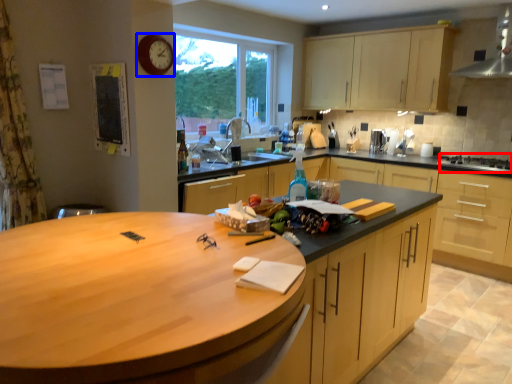
Question: Which point is further to the camera, gas stove (highlighted by a red box) or clock (highlighted by a blue box)?

Choices:
 (A) gas stove
 (B) clock

Answer: (A)